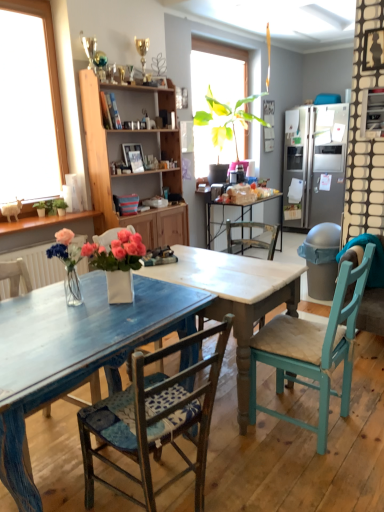
Question: Is distressed blue chair at lower left, which appears as the 3th chair when viewed from the right, outside of wooden cabinet at center?

Choices:
 (A) no
 (B) yes

Answer: (B)

Question: Is distressed blue chair at lower left, which appears as the 3th chair when viewed from the right, further to the viewer compared to wooden cabinet at center?

Choices:
 (A) no
 (B) yes

Answer: (A)

Question: Does distressed blue chair at lower left, the first chair positioned from the left, have a larger size compared to wooden cabinet at center?

Choices:
 (A) no
 (B) yes

Answer: (A)

Question: Would you consider distressed blue chair at lower left, the first chair positioned from the left, to be distant from wooden cabinet at center?

Choices:
 (A) yes
 (B) no

Answer: (A)

Question: Can you confirm if distressed blue chair at lower left, which appears as the 3th chair when viewed from the right, is shorter than wooden cabinet at center?

Choices:
 (A) yes
 (B) no

Answer: (A)

Question: Considering the positions of wooden chair with blue cushion at center, the 2th chair when ordered from right to left, and wooden cabinet at center in the image, is wooden chair with blue cushion at center, the 2th chair when ordered from right to left, taller or shorter than wooden cabinet at center?

Choices:
 (A) tall
 (B) short

Answer: (B)

Question: In the image, is wooden chair with blue cushion at center, the 2th chair when ordered from right to left, on the left side or the right side of wooden cabinet at center?

Choices:
 (A) right
 (B) left

Answer: (A)

Question: Does point (145, 417) appear closer or farther from the camera than point (168, 177)?

Choices:
 (A) closer
 (B) farther

Answer: (A)

Question: From the image's perspective, is wooden chair with blue cushion at center, arranged as the 2th chair when viewed from the left, located above or below wooden cabinet at center?

Choices:
 (A) above
 (B) below

Answer: (B)

Question: Which is correct: white marble table at center is inside satin silver refrigerator at right, or outside of it?

Choices:
 (A) inside
 (B) outside

Answer: (B)

Question: Relative to satin silver refrigerator at right, is white marble table at center in front or behind?

Choices:
 (A) front
 (B) behind

Answer: (A)

Question: From their relative heights in the image, would you say white marble table at center is taller or shorter than satin silver refrigerator at right?

Choices:
 (A) tall
 (B) short

Answer: (B)

Question: Visually, is white marble table at center positioned to the left or to the right of satin silver refrigerator at right?

Choices:
 (A) right
 (B) left

Answer: (B)

Question: In the image, is wooden chair with blue cushion at center, the 2th chair when ordered from right to left, positioned in front of or behind blue painted wood table at center?

Choices:
 (A) front
 (B) behind

Answer: (B)

Question: In terms of width, does wooden chair with blue cushion at center, arranged as the 2th chair when viewed from the left, look wider or thinner when compared to blue painted wood table at center?

Choices:
 (A) wide
 (B) thin

Answer: (B)